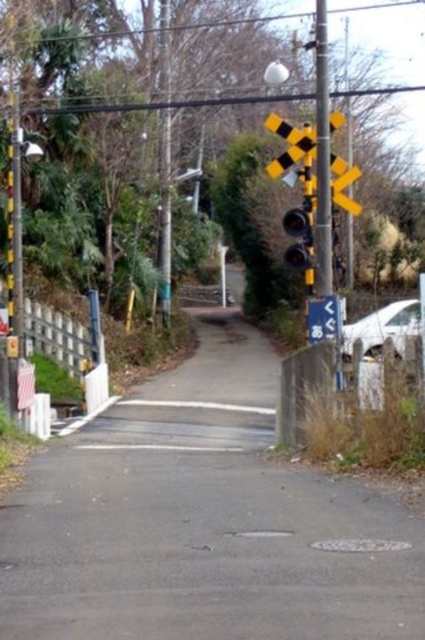
Question: Which point is closer to the camera?

Choices:
 (A) asphalt road at center
 (B) blue plastic sign at center

Answer: (A)

Question: Is asphalt road at center smaller than blue plastic sign at center?

Choices:
 (A) no
 (B) yes

Answer: (A)

Question: Based on their relative distances, which object is farther from the metallic traffic light at center?

Choices:
 (A) asphalt road at center
 (B) blue plastic sign at center

Answer: (A)

Question: Which point is farther from the camera taking this photo?

Choices:
 (A) (283, 225)
 (B) (312, 321)
 (C) (118, 520)

Answer: (A)

Question: Is the position of metallic traffic light at center more distant than that of blue plastic sign at center?

Choices:
 (A) no
 (B) yes

Answer: (B)

Question: Where is asphalt road at center located in relation to blue plastic sign at center in the image?

Choices:
 (A) below
 (B) above

Answer: (A)